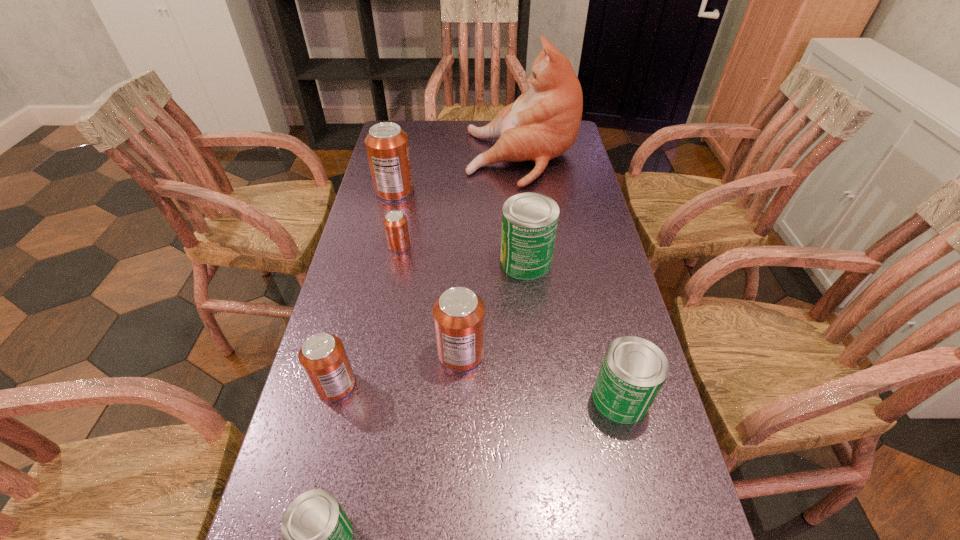
Identify the location of the rightmost green can. (633, 370).

At what (x,y) coordinates should I click in order to perform the action: click on the third nearest orange can. Please return your answer as a coordinate pair (x, y). This screenshot has height=540, width=960. Looking at the image, I should click on (395, 223).

Locate an element on the screen. free space located 0.250m on the face of the orange cat is located at coordinates (396, 158).

This screenshot has width=960, height=540. I want to click on free space located on the face of the orange cat, so click(x=427, y=158).

At what (x,y) coordinates should I click in order to perform the action: click on free space located on the face of the orange cat. Please return your answer as a coordinate pair (x, y). Looking at the image, I should click on (402, 158).

Locate an element on the screen. The image size is (960, 540). free spot located 0.350m on the right of the biggest orange can is located at coordinates (521, 191).

Find the location of `free space located on the front of the farthest green can`. free space located on the front of the farthest green can is located at coordinates (533, 332).

Where is `free space located on the back of the fifth can from left to right`? The image size is (960, 540). free space located on the back of the fifth can from left to right is located at coordinates [x=466, y=232].

Where is `vacant space situated on the right of the second smallest orange can`? This screenshot has height=540, width=960. vacant space situated on the right of the second smallest orange can is located at coordinates (416, 385).

Identify the location of free location located on the left of the second biggest green can. This screenshot has width=960, height=540. (474, 399).